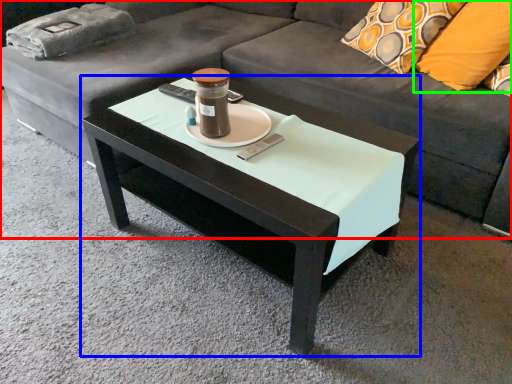
Question: Considering the real-world distances, which object is closest to studio couch (highlighted by a red box)? coffee table (highlighted by a blue box) or pillow (highlighted by a green box).

Choices:
 (A) coffee table
 (B) pillow

Answer: (A)